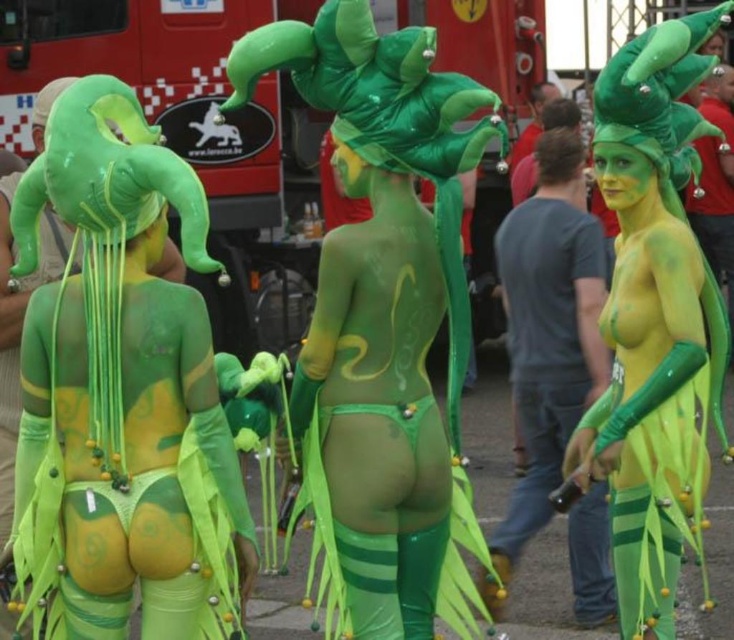
Which of these two, matte green body paint at center or green matte body paint at center, stands shorter?

matte green body paint at center

This screenshot has height=640, width=734. What do you see at coordinates (123, 396) in the screenshot?
I see `matte green body paint at center` at bounding box center [123, 396].

Locate an element on the screen. This screenshot has width=734, height=640. matte green body paint at center is located at coordinates (123, 396).

Does matte green body paint at center appear under dark gray t-shirt at center?

Incorrect, matte green body paint at center is not positioned below dark gray t-shirt at center.

Is point (119, 305) behind point (541, 189)?

No, (119, 305) is closer to viewer.

Who is more forward, [159,520] or [603,524]?

Positioned in front is point [159,520].

This screenshot has width=734, height=640. I want to click on matte green body paint at center, so click(x=123, y=396).

Does green matte body paint at center lie behind dark gray t-shirt at center?

No, it is in front of dark gray t-shirt at center.

Is green matte body paint at center in front of dark gray t-shirt at center?

Yes, green matte body paint at center is in front of dark gray t-shirt at center.

Where is `green matte body paint at center`? green matte body paint at center is located at coordinates (654, 324).